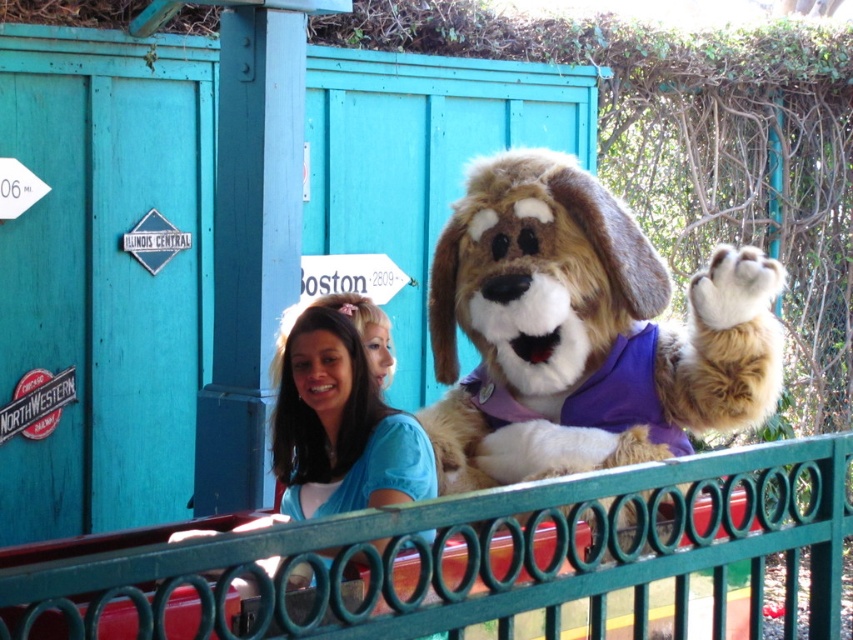
Is green metal fence at center taller than fluffy brown dog at center?

No, green metal fence at center is not taller than fluffy brown dog at center.

Image resolution: width=853 pixels, height=640 pixels. I want to click on green metal fence at center, so click(492, 554).

Identify the location of green metal fence at center. The height and width of the screenshot is (640, 853). (492, 554).